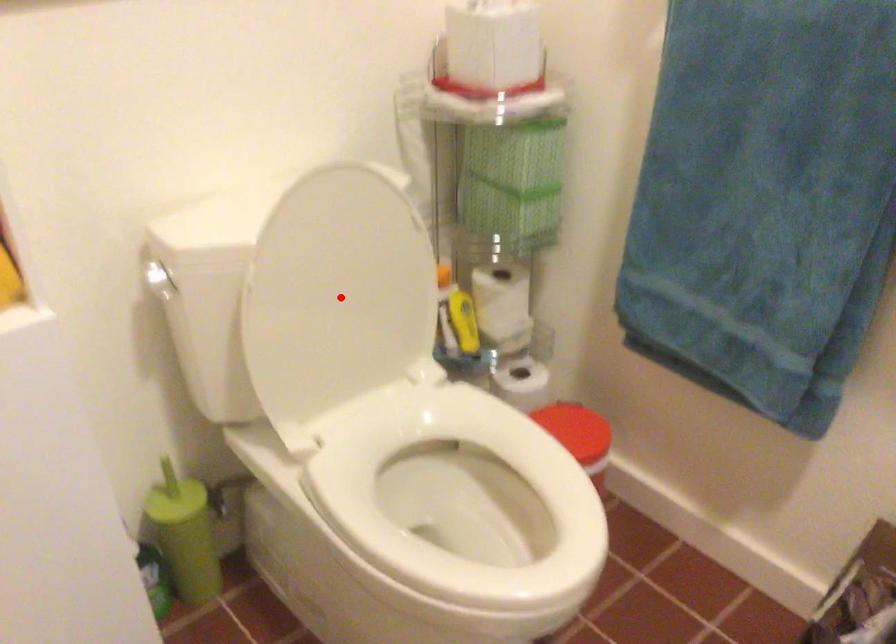
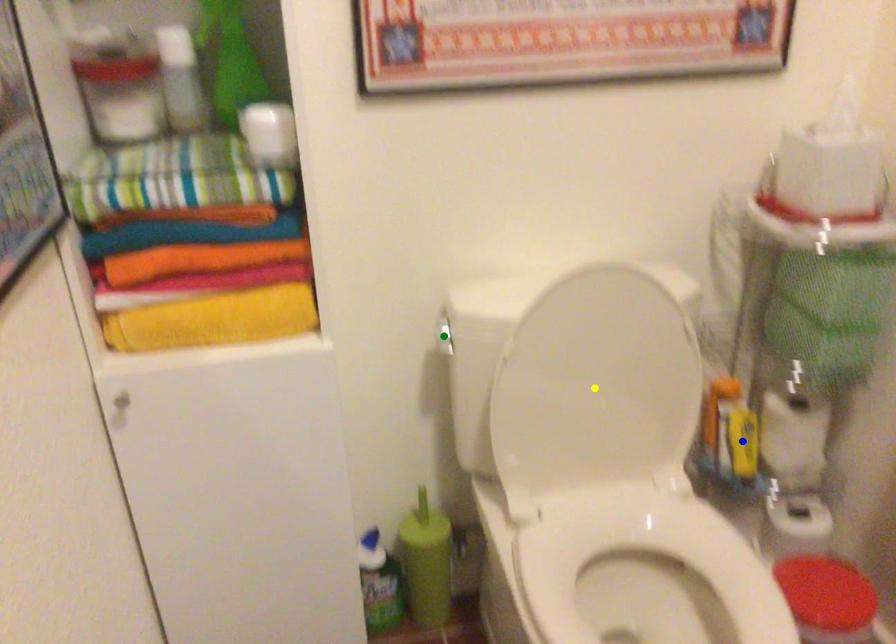
Question: I am providing you with two images of the same scene from different viewpoints. A red point is marked on the first image. You are given multiple points on the second image. Which mark in image 2 goes with the point in image 1?

Choices:
 (A) yellow point
 (B) blue point
 (C) green point

Answer: (A)